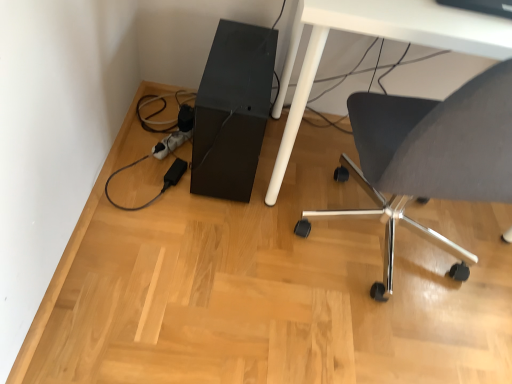
I want to click on free space in front of black matte computer tower at lower center, so click(215, 244).